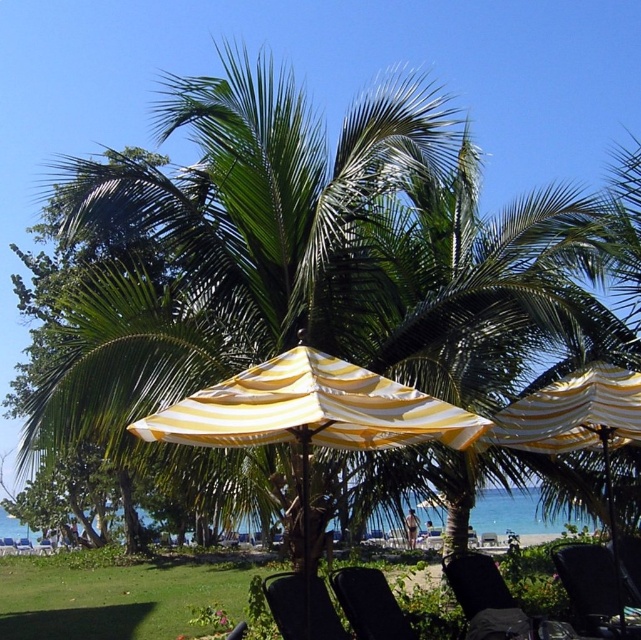
Question: Does black fabric chair at lower center appear on the left side of black fabric chair at lower right?

Choices:
 (A) yes
 (B) no

Answer: (A)

Question: Is yellow striped fabric umbrella at center to the left of black plastic chair at lower center from the viewer's perspective?

Choices:
 (A) yes
 (B) no

Answer: (A)

Question: Which of the following is the farthest from the observer?

Choices:
 (A) (633, 540)
 (B) (354, 600)
 (C) (283, 628)
 (D) (460, 561)

Answer: (A)

Question: Does yellow striped fabric umbrella at center appear on the right side of black plastic chair at lower center?

Choices:
 (A) yes
 (B) no

Answer: (B)

Question: Among these objects, which one is farthest from the camera?

Choices:
 (A) yellow striped umbrella at center
 (B) black fabric chair at lower center
 (C) black fabric beach chair at lower right
 (D) yellow striped fabric umbrella at center

Answer: (B)

Question: Which point is closer to the camera?

Choices:
 (A) black plastic chair at lower center
 (B) black fabric chair at lower right

Answer: (A)